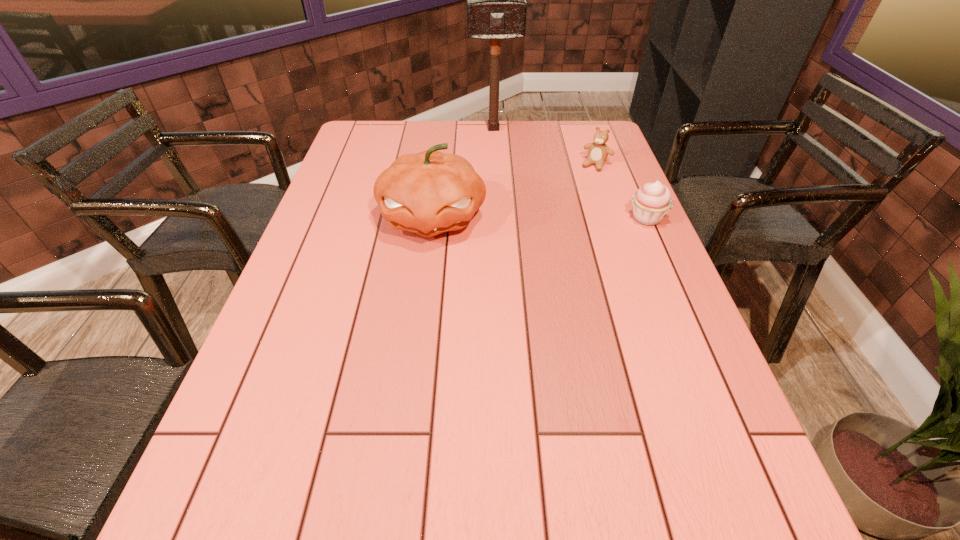
The width and height of the screenshot is (960, 540). In order to click on free space on the desktop that is between the second tallest object and the cupcake and is positioned on the head of the mallet in this screenshot , I will do `click(508, 218)`.

At what (x,y) coordinates should I click in order to perform the action: click on free spot on the desktop that is between the third shortest object and the cupcake and is positioned on the front-facing side of the second farthest object. Please return your answer as a coordinate pair (x, y). Looking at the image, I should click on (561, 218).